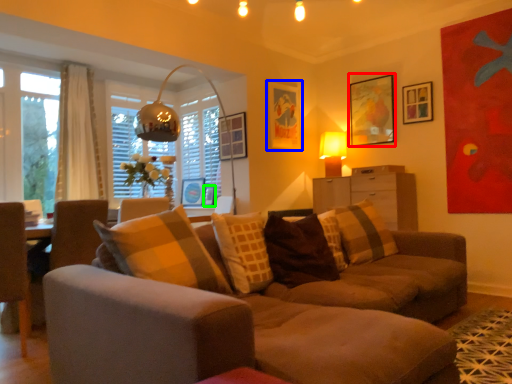
Question: Estimate the real-world distances between objects in this image. Which object is closer to picture frame (highlighted by a red box), picture frame (highlighted by a blue box) or picture frame (highlighted by a green box)?

Choices:
 (A) picture frame
 (B) picture frame

Answer: (A)